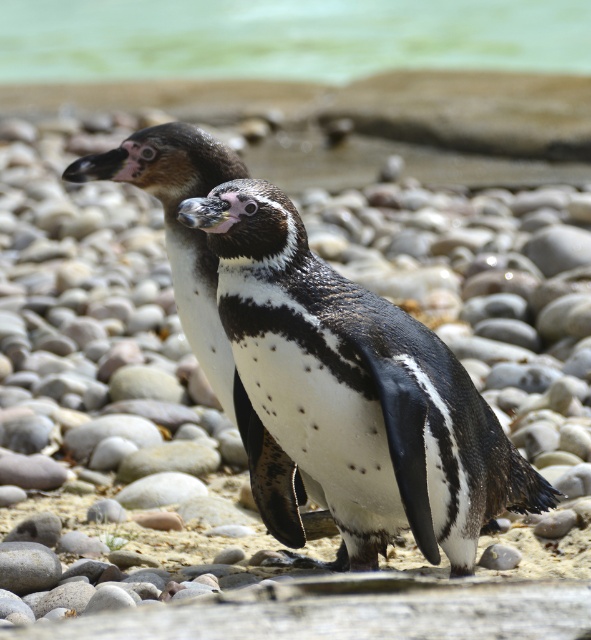
Question: Which object is closer to the camera taking this photo?

Choices:
 (A) green water at upper center
 (B) black and white penguin at center

Answer: (B)

Question: Is black and white penguin at center positioned behind green water at upper center?

Choices:
 (A) yes
 (B) no

Answer: (B)

Question: Which of the following is the farthest from the observer?

Choices:
 (A) black and white penguin at center
 (B) green water at upper center

Answer: (B)

Question: Can you confirm if black and white penguin at center is positioned below green water at upper center?

Choices:
 (A) no
 (B) yes

Answer: (B)

Question: Which point is farther from the camera taking this photo?

Choices:
 (A) (350, 4)
 (B) (538, 480)

Answer: (A)

Question: Is black and white penguin at center further to the viewer compared to green water at upper center?

Choices:
 (A) no
 (B) yes

Answer: (A)